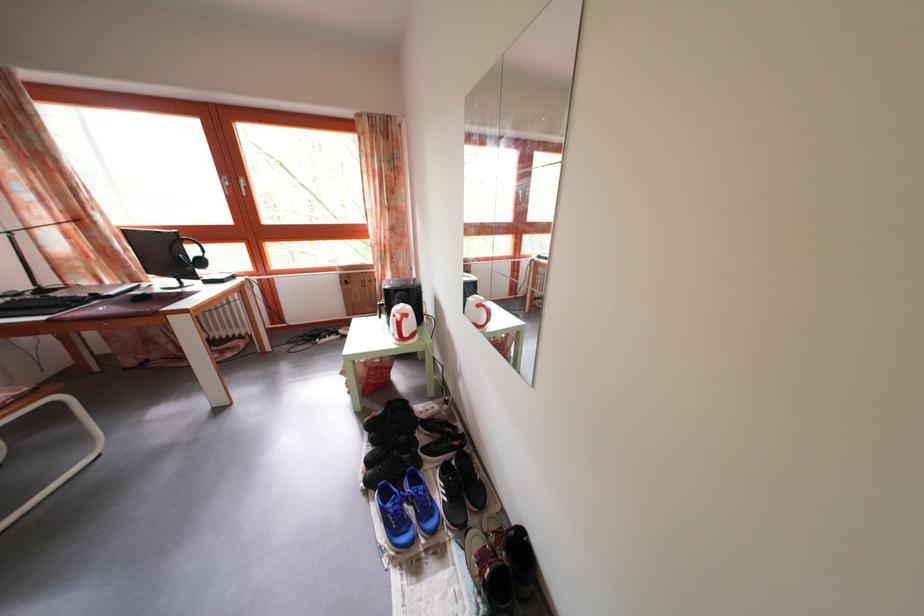
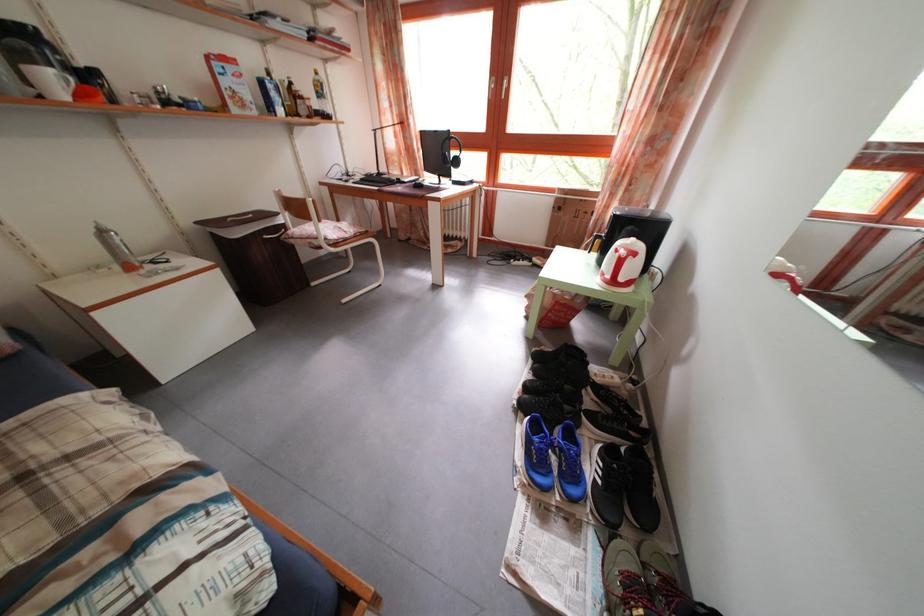
Locate, in the second image, the point that corresponds to the point at 116,290 in the first image.

(412, 182)